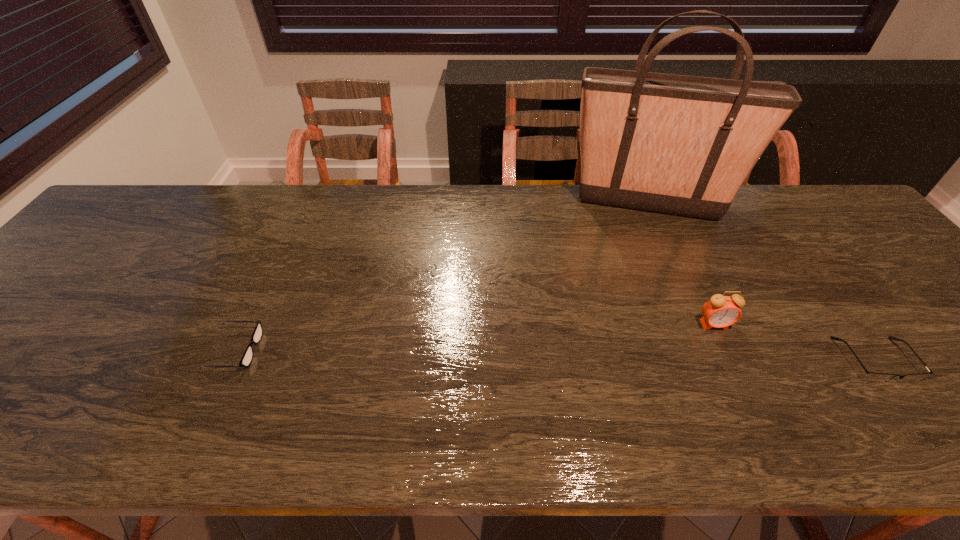
You are a GUI agent. You are given a task and a screenshot of the screen. Output one action in this format:
    pyautogui.click(x=<x>, y=<y>)
    Task: Click on the tallest object
    The width and height of the screenshot is (960, 540).
    Given the screenshot: What is the action you would take?
    pyautogui.click(x=682, y=145)

The height and width of the screenshot is (540, 960). Find the location of `shopping bag`. shopping bag is located at coordinates (682, 145).

The width and height of the screenshot is (960, 540). I want to click on alarm clock, so click(x=720, y=311).

At what (x,y) coordinates should I click in order to perform the action: click on the leftmost object. Please return your answer as a coordinate pair (x, y). Looking at the image, I should click on (246, 359).

What are the coordinates of `the rightmost object` in the screenshot? It's located at (871, 376).

Where is `vacant space situated 0.250m on the left of the tallest object`? Image resolution: width=960 pixels, height=540 pixels. vacant space situated 0.250m on the left of the tallest object is located at coordinates coord(483,204).

Locate an element on the screen. This screenshot has height=540, width=960. vacant area situated 0.250m on the face of the second tallest object is located at coordinates (765, 435).

At what (x,y) coordinates should I click in order to perform the action: click on blank space located 0.080m on the front-facing side of the leftmost object. Please return your answer as a coordinate pair (x, y). The height and width of the screenshot is (540, 960). Looking at the image, I should click on (293, 349).

Find the location of a particular element. This screenshot has width=960, height=540. blank space located 0.090m on the front-facing side of the rightmost object is located at coordinates (923, 425).

The width and height of the screenshot is (960, 540). I want to click on object positioned at the far edge, so click(x=682, y=145).